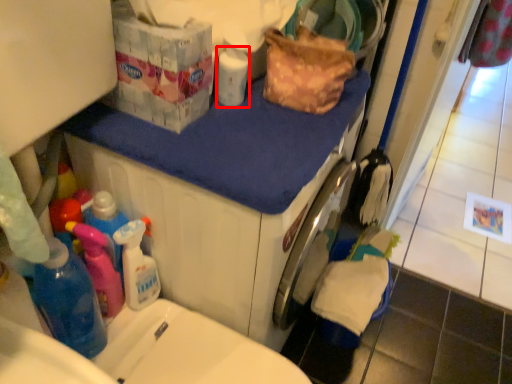
Question: Observing the image, what is the correct spatial positioning of cleaning product (annotated by the red box) in reference to counter top?

Choices:
 (A) right
 (B) left

Answer: (B)